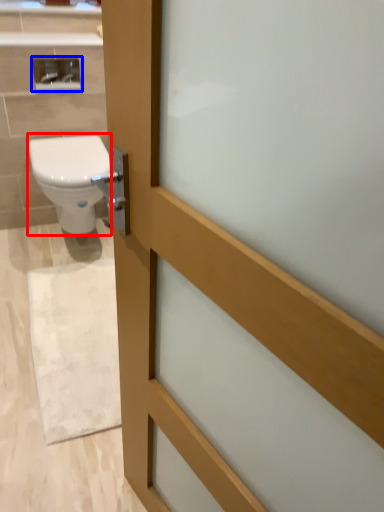
Question: Which point is further to the camera, bidet (highlighted by a red box) or medicine cabinet (highlighted by a blue box)?

Choices:
 (A) bidet
 (B) medicine cabinet

Answer: (B)